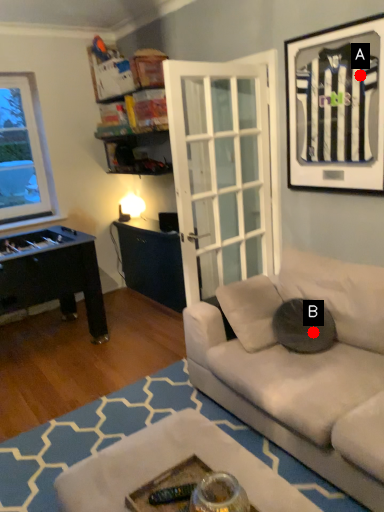
Question: Two points are circled on the image, labeled by A and B beside each circle. Which point is closer to the camera?

Choices:
 (A) A is closer
 (B) B is closer

Answer: (A)